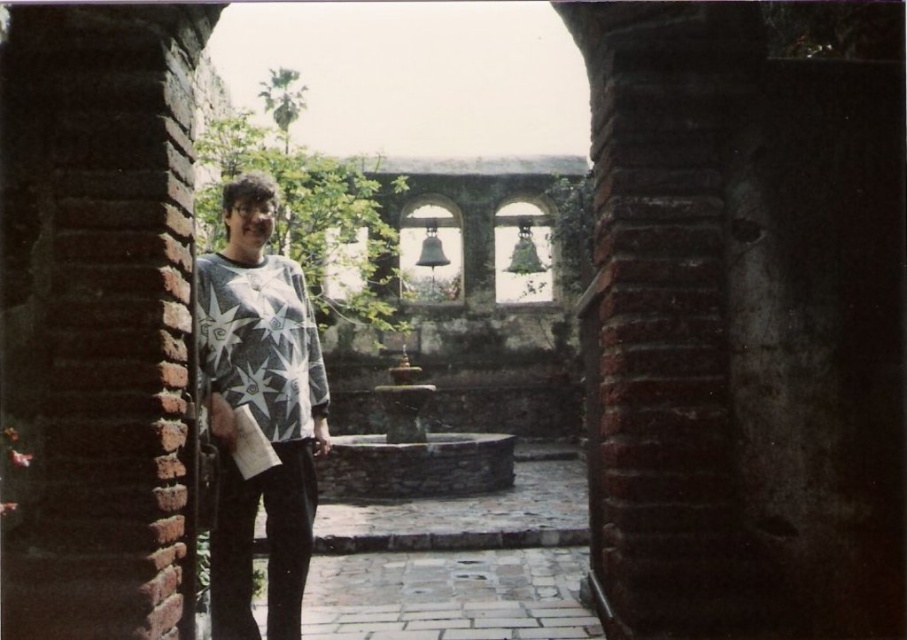
You are standing in the courtyard and notice a specific point marked at coordinates (259, 410). What object in the scene is located at that point?

The point at coordinates (259, 410) corresponds to the white star patterned sweater at center.

You are standing in the courtyard and want to walk towards the closest point between point [290,589] and point [314,340]. Which point should you head towards?

Point [290,589] is closer to the viewer than point [314,340], so you should head towards point [290,589].